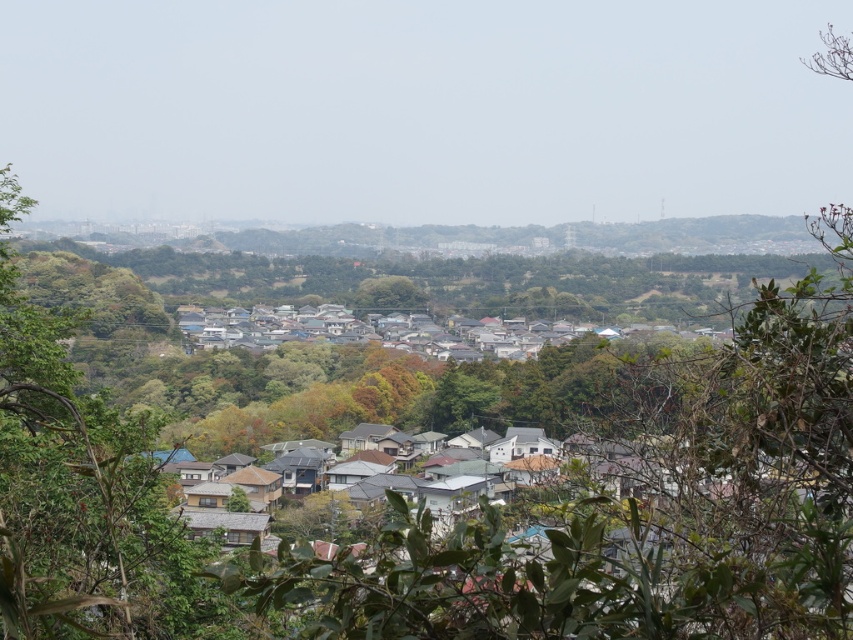
Based on the photo, you are standing in the residential area surrounded by greenery and looking at the green leafy tree at left and the green leafy tree at center. Which tree appears closer to you?

The green leafy tree at left appears closer because it is positioned below the green leafy tree at center, indicating it is in a lower plane and thus nearer to the observer.

You are standing in the residential area surrounded by greenery. You see a point marked at coordinates [80,499]. What object does this point correspond to?

The point at coordinates [80,499] corresponds to the green leafy tree at left.

You are a bird looking for a nesting spot. You see the green leafy tree at left and the green leafy tree at center. Which tree would you choose if you prefer a thicker trunk for better stability?

The green leafy tree at center has a thicker trunk compared to the green leafy tree at left, so the bird would choose the green leafy tree at center for better stability.